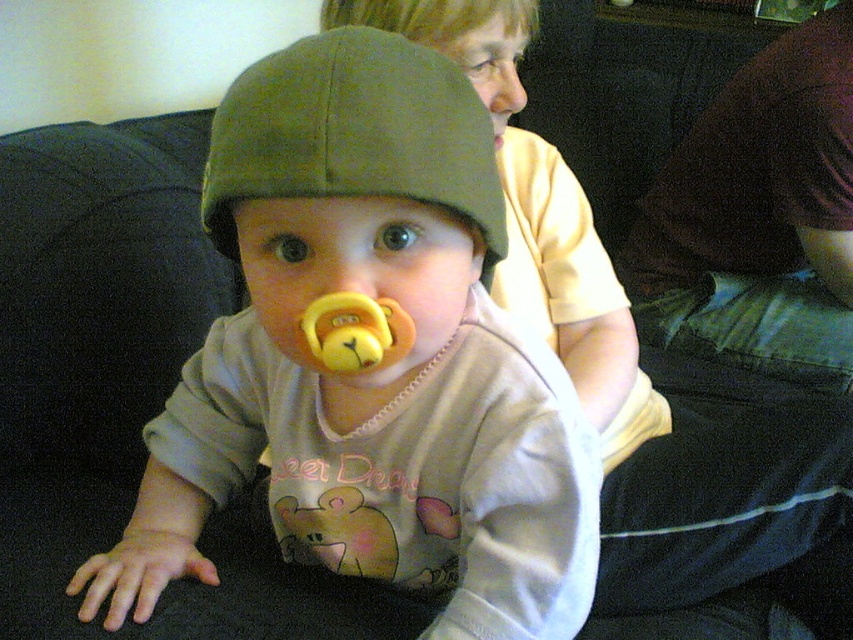
Who is higher up, green felt hat at center or yellow rubber pacifier at center?

green felt hat at center is higher up.

Is green felt hat at center thinner than yellow rubber pacifier at center?

In fact, green felt hat at center might be wider than yellow rubber pacifier at center.

Who is more distant from viewer, (346, 148) or (363, 300)?

Point (363, 300)

I want to click on green felt hat at center, so [352, 134].

Is light beige shirt at upper center further to camera compared to yellow rubber pacifier at center?

Yes, it is.

What do you see at coordinates (656, 412) in the screenshot? I see `light beige shirt at upper center` at bounding box center [656, 412].

The height and width of the screenshot is (640, 853). Find the location of `light beige shirt at upper center`. light beige shirt at upper center is located at coordinates (656, 412).

Can you confirm if matte green hat at center is positioned above light beige shirt at upper center?

No.

Between matte green hat at center and light beige shirt at upper center, which one is positioned higher?

Positioned higher is light beige shirt at upper center.

What do you see at coordinates (369, 371) in the screenshot? Image resolution: width=853 pixels, height=640 pixels. I see `matte green hat at center` at bounding box center [369, 371].

What are the coordinates of `matte green hat at center` in the screenshot? It's located at (369, 371).